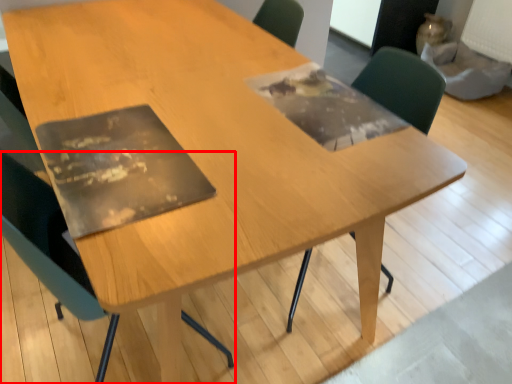
Question: From the image's perspective, considering the relative positions of chair (annotated by the red box) and chair in the image provided, where is chair (annotated by the red box) located with respect to the staircase?

Choices:
 (A) above
 (B) below

Answer: (B)